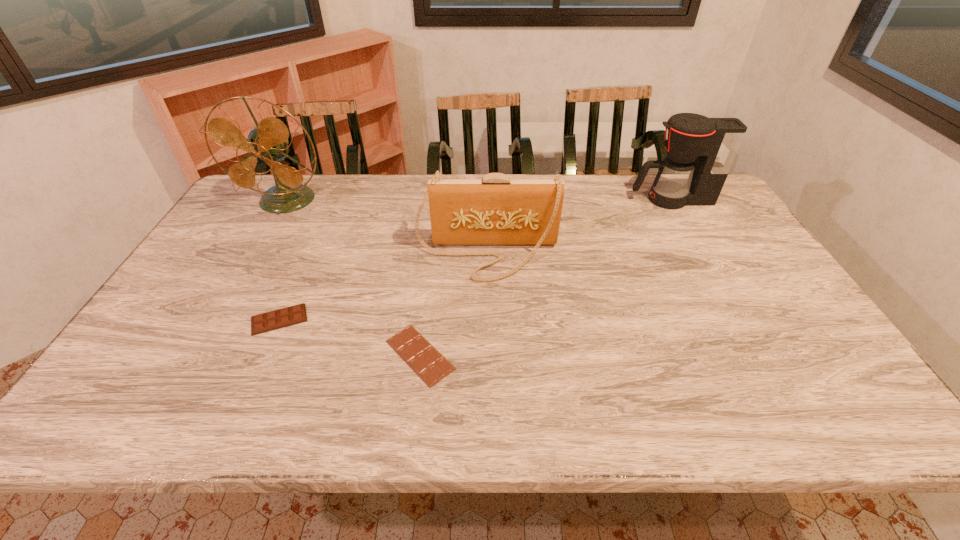
Find the location of `object that can be found as the fourth closest to the rightmost object`. object that can be found as the fourth closest to the rightmost object is located at coordinates (273, 320).

Where is `vacant area in the image that satisfies the following two spatial constraints: 1. in front of the shortest object, directing air flow; 2. on the left side of the tallest object`? vacant area in the image that satisfies the following two spatial constraints: 1. in front of the shortest object, directing air flow; 2. on the left side of the tallest object is located at coordinates (198, 355).

I want to click on vacant area that satisfies the following two spatial constraints: 1. in front of the shorter chocolate bar, directing air flow; 2. on the left side of the fan, so click(198, 355).

The width and height of the screenshot is (960, 540). Identify the location of blank area in the image that satisfies the following two spatial constraints: 1. in front of the right chocolate bar, directing air flow; 2. on the right side of the fan. (198, 355).

I want to click on vacant space that satisfies the following two spatial constraints: 1. pour from the carafe of the rightmost object; 2. on the front side of the shorter chocolate bar, so click(760, 355).

The width and height of the screenshot is (960, 540). What are the coordinates of `free region that satisfies the following two spatial constraints: 1. in front of the left chocolate bar, directing air flow; 2. on the right side of the tallest object` in the screenshot? It's located at (218, 319).

Where is `vacant space that satisfies the following two spatial constraints: 1. pour from the carafe of the coffee maker; 2. on the decorative side of the third shortest object`? The image size is (960, 540). vacant space that satisfies the following two spatial constraints: 1. pour from the carafe of the coffee maker; 2. on the decorative side of the third shortest object is located at coordinates (703, 254).